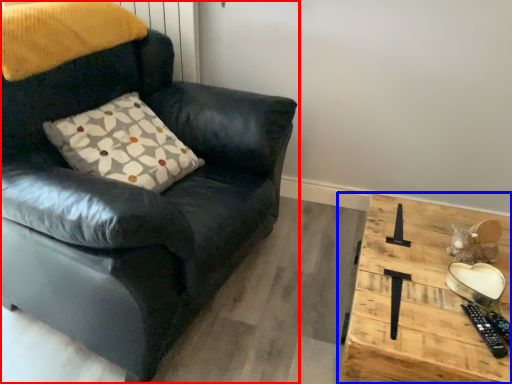
Question: Which object is further to the camera taking this photo, chair (highlighted by a red box) or table (highlighted by a blue box)?

Choices:
 (A) chair
 (B) table

Answer: (B)